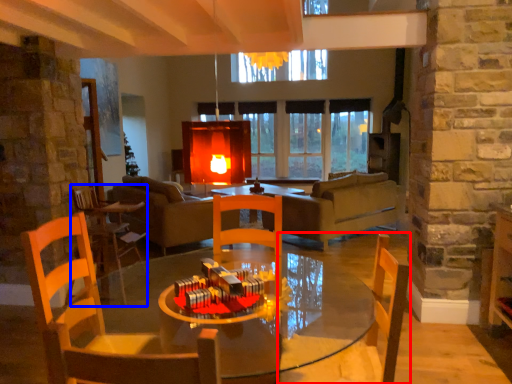
Question: Which point is further to the camera, chair (highlighted by a red box) or chair (highlighted by a blue box)?

Choices:
 (A) chair
 (B) chair

Answer: (B)